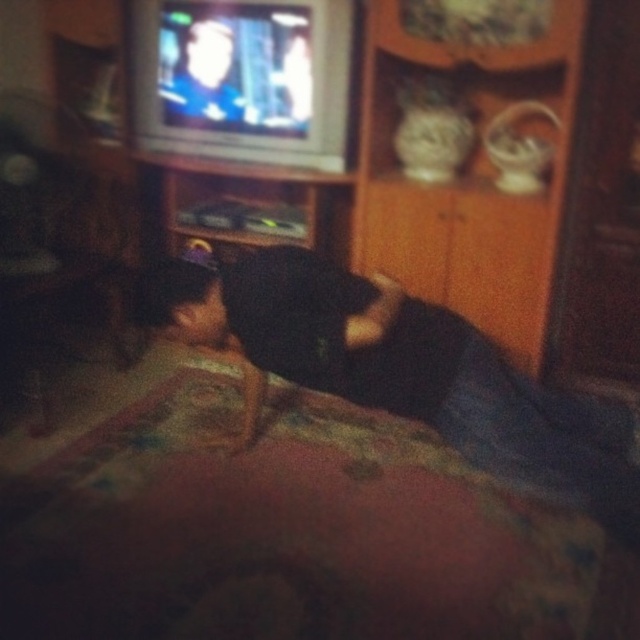
Question: Is dark fabric at center bigger than smooth skin man at upper center?

Choices:
 (A) no
 (B) yes

Answer: (B)

Question: In this image, where is dark fabric at center located relative to smooth skin man at upper center?

Choices:
 (A) below
 (B) above

Answer: (A)

Question: Which object appears closest to the camera in this image?

Choices:
 (A) smooth skin man at upper center
 (B) dark fabric at center

Answer: (B)

Question: Does dark fabric at center appear on the left side of smooth skin man at upper center?

Choices:
 (A) no
 (B) yes

Answer: (A)